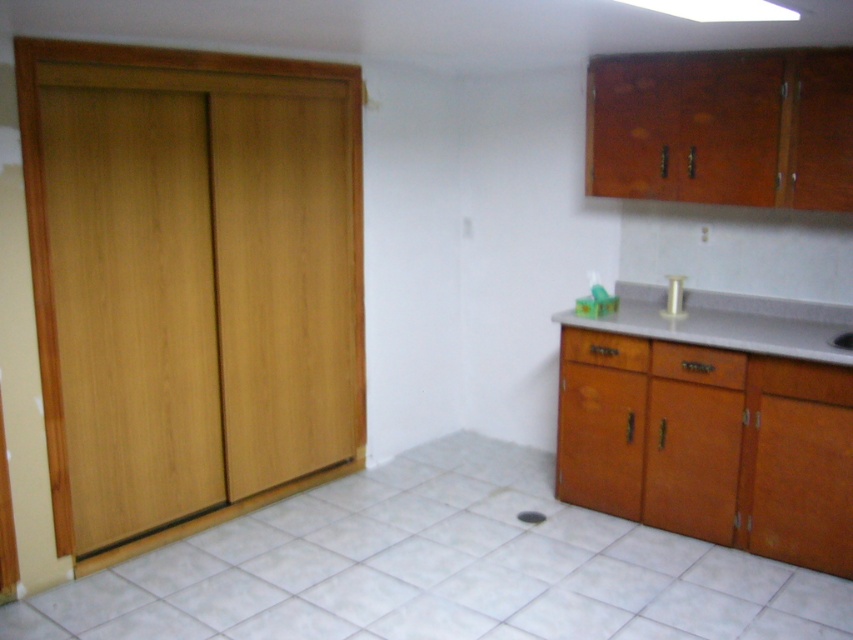
Does wooden drawer at lower center have a lesser width compared to wooden drawer at lower right?

Yes.

Does wooden drawer at lower center appear on the right side of wooden drawer at lower right?

Yes, wooden drawer at lower center is to the right of wooden drawer at lower right.

Between point (694, 374) and point (573, 355), which one is positioned behind?

Positioned behind is point (573, 355).

I want to click on wooden drawer at lower center, so click(698, 364).

Consider the image. Does smooth gray countertop at right have a greater height compared to wooden drawer at lower right?

Yes.

Can you confirm if smooth gray countertop at right is positioned to the right of wooden drawer at lower right?

Yes, smooth gray countertop at right is to the right of wooden drawer at lower right.

Between point (811, 440) and point (584, 358), which one is positioned in front?

Point (811, 440) is in front.

Image resolution: width=853 pixels, height=640 pixels. In order to click on smooth gray countertop at right in this screenshot , I will do `click(717, 426)`.

Is gray laminate counter at right closer to camera compared to wooden drawer at lower center?

Yes, gray laminate counter at right is closer to the viewer.

Who is more forward, (779, 326) or (718, 365)?

Point (718, 365) is in front.

Does point (676, 316) come farther from viewer compared to point (711, 378)?

Yes, it is.

Image resolution: width=853 pixels, height=640 pixels. What are the coordinates of `gray laminate counter at right` in the screenshot? It's located at (726, 323).